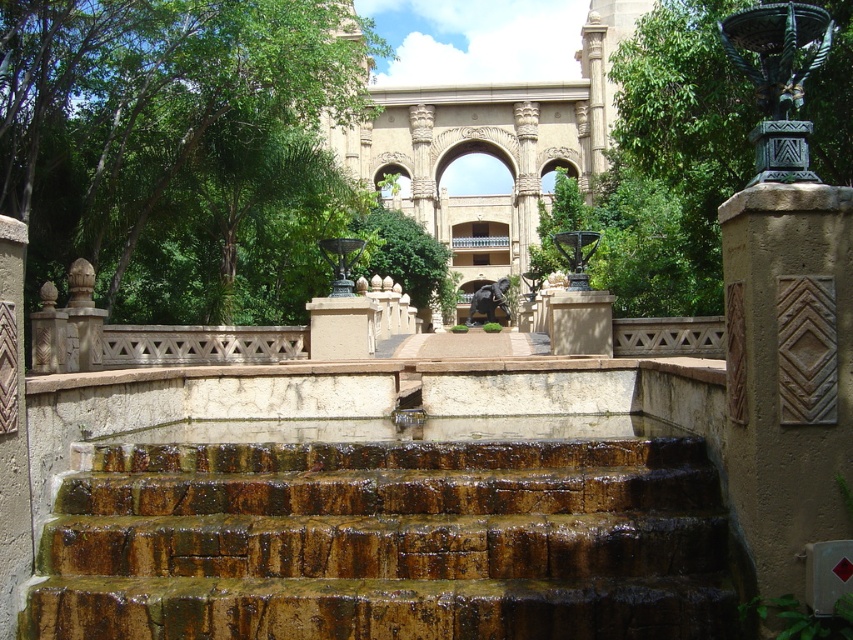
Is brown stone stairs at center to the right of brown textured stone at right from the viewer's perspective?

No, brown stone stairs at center is not to the right of brown textured stone at right.

Find the location of `brown stone stairs at center`. brown stone stairs at center is located at coordinates (387, 541).

You are a GUI agent. You are given a task and a screenshot of the screen. Output one action in this format:
    pyautogui.click(x=<x>, y=<y>)
    Task: Click on the brown stone stairs at center
    Image resolution: width=853 pixels, height=640 pixels.
    Given the screenshot: What is the action you would take?
    pyautogui.click(x=387, y=541)

Is the position of brown textured stone at right less distant than that of sandstone archway at center?

Yes.

This screenshot has height=640, width=853. Describe the element at coordinates (787, 372) in the screenshot. I see `brown textured stone at right` at that location.

Where is `brown textured stone at right`? brown textured stone at right is located at coordinates [787, 372].

Measure the distance between brown stone stairs at center and sandstone archway at center.

They are 134.29 meters apart.

Is point (395, 538) closer to viewer compared to point (515, 259)?

Yes, it is.

The width and height of the screenshot is (853, 640). I want to click on brown stone stairs at center, so click(x=387, y=541).